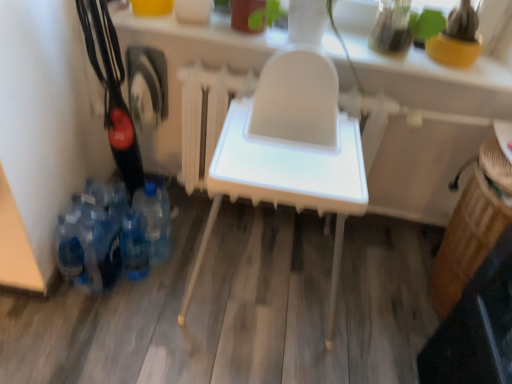
Find the location of `unoccupied region to the right of blue plastic bottles at lower left, which ranks as the first bottle in left-to-right order`. unoccupied region to the right of blue plastic bottles at lower left, which ranks as the first bottle in left-to-right order is located at coordinates (159, 288).